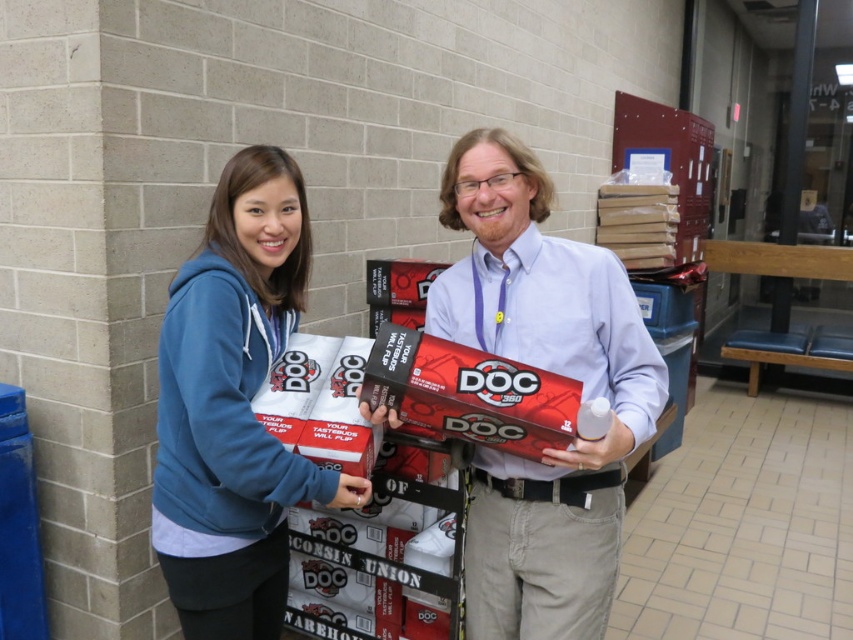
Does matte white box at center have a smaller size compared to blue fleece hoodie at left?

No.

Is matte white box at center shorter than blue fleece hoodie at left?

No, matte white box at center is not shorter than blue fleece hoodie at left.

You are a GUI agent. You are given a task and a screenshot of the screen. Output one action in this format:
    pyautogui.click(x=<x>, y=<y>)
    Task: Click on the matte white box at center
    
    Given the screenshot: What is the action you would take?
    pyautogui.click(x=546, y=369)

Is blue fleece hoodie at left wider than red matte/doc at center?

Indeed, blue fleece hoodie at left has a greater width compared to red matte/doc at center.

Which is in front, point (247, 184) or point (422, 424)?

Positioned in front is point (422, 424).

What do you see at coordinates (234, 406) in the screenshot?
I see `blue fleece hoodie at left` at bounding box center [234, 406].

The image size is (853, 640). Identify the location of blue fleece hoodie at left. (234, 406).

Is matte white box at center in front of red matte/doc at center?

Yes.

Which is behind, point (585, 497) or point (412, 422)?

The point (585, 497) is more distant.

Who is more forward, (460, 209) or (451, 368)?

Positioned in front is point (451, 368).

Locate an element on the screen. matte white box at center is located at coordinates (546, 369).